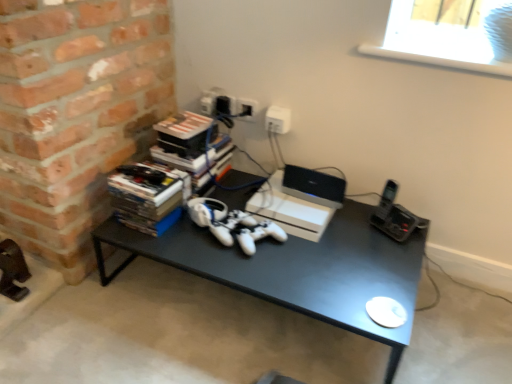
In order to click on white plastic window screen at upper right in this screenshot , I will do `click(450, 34)`.

Where is `white plastic electric outlet at upper center`? This screenshot has height=384, width=512. white plastic electric outlet at upper center is located at coordinates (278, 119).

Where is `white matte gaming console at center`? The width and height of the screenshot is (512, 384). white matte gaming console at center is located at coordinates (297, 202).

You are a GUI agent. You are given a task and a screenshot of the screen. Output one action in this format:
    pyautogui.click(x=<x>, y=<y>)
    Task: Click on the white plastic laptop at center
    The height and width of the screenshot is (384, 512).
    Given the screenshot: What is the action you would take?
    pyautogui.click(x=313, y=186)

This screenshot has width=512, height=384. Identify the location of white plastic window screen at upper right. (450, 34).

How many degrees apart are the facing directions of white plastic electric outlet at upper center and hardcover books at left?

0.000803 degrees separate the facing orientations of white plastic electric outlet at upper center and hardcover books at left.

Can you confirm if white plastic electric outlet at upper center is wider than hardcover books at left?

Incorrect, the width of white plastic electric outlet at upper center does not surpass that of hardcover books at left.

Is white plastic electric outlet at upper center behind hardcover books at left?

Yes.

Where is `book below the white plastic electric outlet at upper center (from the image's perspective)`? This screenshot has height=384, width=512. book below the white plastic electric outlet at upper center (from the image's perspective) is located at coordinates (146, 198).

Can you confirm if hardcover books at left is bigger than white matte gaming console at center?

No.

From the picture: Relative to white matte gaming console at center, is hardcover books at left in front or behind?

Clearly, hardcover books at left is in front of white matte gaming console at center.

From a real-world perspective, does hardcover books at left stand above white matte gaming console at center?

Indeed, from a real-world perspective, hardcover books at left stands above white matte gaming console at center.

Is hardcover books at left positioned far away from white matte gaming console at center?

hardcover books at left is near white matte gaming console at center, not far away.

Do you think hardcover books at left is within white plastic laptop at center, or outside of it?

hardcover books at left is outside white plastic laptop at center.

Is hardcover books at left wider than white plastic laptop at center?

Yes.

From the image's perspective, between hardcover books at left and white plastic laptop at center, who is located below?

hardcover books at left is shown below in the image.

Is white matte gaming console at center inside the boundaries of white plastic electric outlet at upper center, or outside?

white matte gaming console at center is located beyond the bounds of white plastic electric outlet at upper center.

Could you tell me if white matte gaming console at center is turned towards white plastic electric outlet at upper center?

No, white matte gaming console at center is not oriented towards white plastic electric outlet at upper center.

Is white matte gaming console at center wider than white plastic electric outlet at upper center?

Yes, white matte gaming console at center is wider than white plastic electric outlet at upper center.

Which is behind, point (333, 189) or point (284, 114)?

Positioned behind is point (284, 114).

Considering the points (319, 193) and (331, 181), which point is behind, point (319, 193) or point (331, 181)?

The point (331, 181) is farther.

Can you confirm if white plastic laptop at center is taller than white matte gaming console at center?

Indeed, white plastic laptop at center has a greater height compared to white matte gaming console at center.

What's the angular difference between white plastic laptop at center and white matte gaming console at center's facing directions?

0.000697 degrees separate the facing orientations of white plastic laptop at center and white matte gaming console at center.

Between white plastic laptop at center and white matte gaming console at center, which one appears on the right side from the viewer's perspective?

white plastic laptop at center is more to the right.

Which object is closer to the camera taking this photo, white plastic laptop at center or hardcover books at left?

hardcover books at left is more forward.

Which of these two, white plastic laptop at center or hardcover books at left, stands taller?

Standing taller between the two is hardcover books at left.

Is white plastic laptop at center located outside hardcover books at left?

Yes, white plastic laptop at center is located beyond the bounds of hardcover books at left.

From the picture: Which of these two, white plastic laptop at center or hardcover books at left, is bigger?

With larger size is hardcover books at left.

How far apart are black matte desk at center and hardcover books at left?

black matte desk at center is 11.38 inches from hardcover books at left.

Is black matte desk at center completely or partially outside of hardcover books at left?

Yes, black matte desk at center is located beyond the bounds of hardcover books at left.

Can you confirm if black matte desk at center is thinner than hardcover books at left?

No, black matte desk at center is not thinner than hardcover books at left.

Does black matte desk at center turn towards hardcover books at left?

No, black matte desk at center is not turned towards hardcover books at left.

You are a GUI agent. You are given a task and a screenshot of the screen. Output one action in this format:
    pyautogui.click(x=<x>, y=<y>)
    Task: Click on the electric outlet behind the hardcover books at left
    The image size is (512, 384).
    Given the screenshot: What is the action you would take?
    pyautogui.click(x=278, y=119)

Image resolution: width=512 pixels, height=384 pixels. What are the coordinates of `computer located on the right of hardcover books at left` in the screenshot? It's located at (297, 202).

Estimate the real-world distances between objects in this image. Which object is further from hardcover books at left, white plastic laptop at center or white plastic window screen at upper right?

white plastic window screen at upper right lies further to hardcover books at left than the other object.

Based on their spatial positions, is black matte desk at center or white plastic window screen at upper right closer to white plastic laptop at center?

black matte desk at center is closer to white plastic laptop at center.

Estimate the real-world distances between objects in this image. Which object is further from black matte desk at center, white plastic electric outlet at upper center or white plastic window screen at upper right?

The object further to black matte desk at center is white plastic window screen at upper right.

Looking at the image, which one is located further to white matte gaming console at center, white plastic laptop at center or black matte desk at center?

black matte desk at center lies further to white matte gaming console at center than the other object.

Estimate the real-world distances between objects in this image. Which object is further from hardcover books at left, white plastic window screen at upper right or white matte gaming console at center?

white plastic window screen at upper right lies further to hardcover books at left than the other object.

Estimate the real-world distances between objects in this image. Which object is further from white plastic electric outlet at upper center, black matte desk at center or hardcover books at left?

black matte desk at center.

When comparing their distances from white plastic window screen at upper right, does white plastic electric outlet at upper center or white plastic laptop at center seem closer?

white plastic electric outlet at upper center.

From the image, which object appears to be nearer to white matte gaming console at center, hardcover books at left or black matte desk at center?

Among the two, black matte desk at center is located nearer to white matte gaming console at center.

In order to click on laptop between hardcover books at left and white plastic window screen at upper right in the horizontal direction in this screenshot , I will do `click(313, 186)`.

Where is `computer between black matte desk at center and white plastic laptop at center along the z-axis`? computer between black matte desk at center and white plastic laptop at center along the z-axis is located at coordinates (297, 202).

Identify the location of computer between white plastic electric outlet at upper center and white plastic window screen at upper right in the horizontal direction. (297, 202).

Identify the location of desk located between hardcover books at left and white matte gaming console at center in the left-right direction. (296, 269).